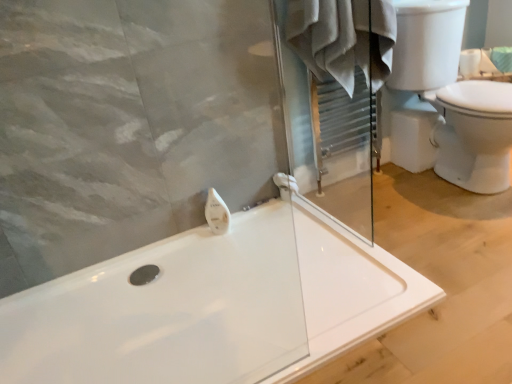
I want to click on vacant space in front of white glossy soap dispenser at upper center, so click(x=219, y=251).